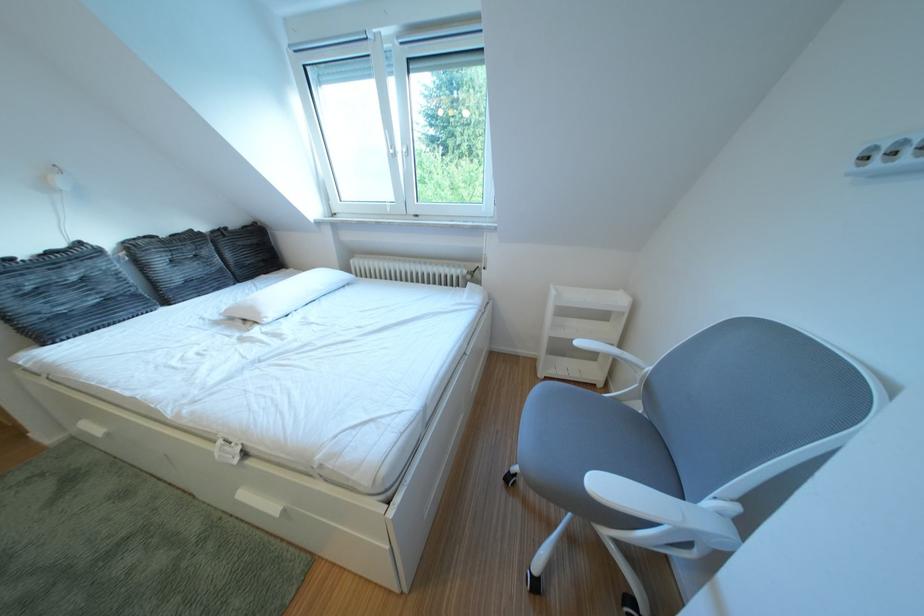
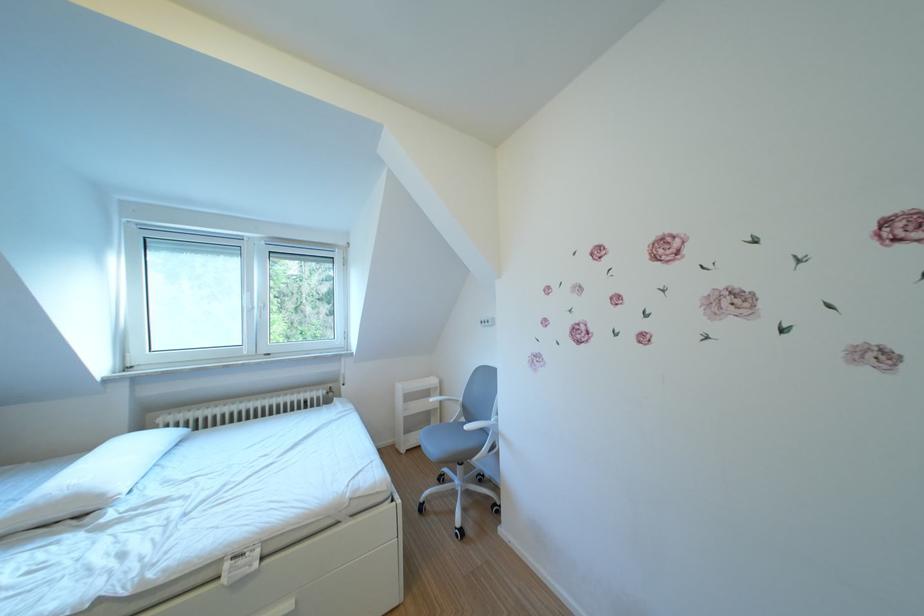
Locate, in the second image, the point that corresponds to point (273, 318) in the first image.

(115, 501)